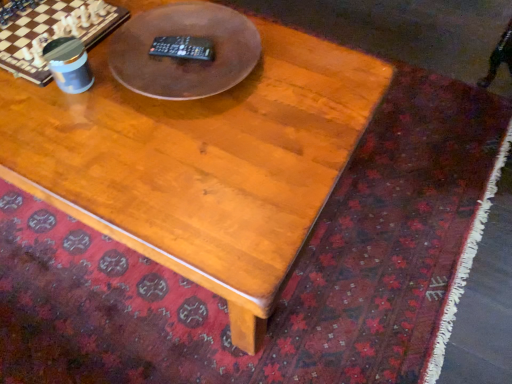
What is the approximate height of brown wooden table at center?

4.86 centimeters.

The width and height of the screenshot is (512, 384). What do you see at coordinates (184, 59) in the screenshot? I see `brown wooden table at center` at bounding box center [184, 59].

Locate an element on the screen. brown wooden table at center is located at coordinates (184, 59).

The image size is (512, 384). In order to click on wooden coffee table at center in this screenshot , I will do `click(201, 162)`.

What is the approximate width of wooden coffee table at center?

The width of wooden coffee table at center is 31.02 inches.

The image size is (512, 384). What do you see at coordinates (201, 162) in the screenshot?
I see `wooden coffee table at center` at bounding box center [201, 162].

Image resolution: width=512 pixels, height=384 pixels. I want to click on brown wooden table at center, so click(x=184, y=59).

Between wooden coffee table at center and brown wooden table at center, which one appears on the left side from the viewer's perspective?

wooden coffee table at center is more to the left.

Consider the image. Is wooden coffee table at center further to camera compared to brown wooden table at center?

No, it is not.

Does point (115, 88) lie in front of point (119, 37)?

Yes, point (115, 88) is closer to viewer.

From the image's perspective, is wooden coffee table at center on top of brown wooden table at center?

No, from the image's perspective, wooden coffee table at center is not on top of brown wooden table at center.

From a real-world perspective, is wooden coffee table at center physically located above or below brown wooden table at center?

In terms of real-world spatial position, wooden coffee table at center is below brown wooden table at center.

In terms of width, does wooden coffee table at center look wider or thinner when compared to brown wooden table at center?

Considering their sizes, wooden coffee table at center looks broader than brown wooden table at center.

Which of these two, wooden coffee table at center or brown wooden table at center, stands shorter?

brown wooden table at center is shorter.

Can you confirm if wooden coffee table at center is smaller than brown wooden table at center?

No.

Based on the photo, is brown wooden table at center located within wooden coffee table at center?

No, brown wooden table at center is not inside wooden coffee table at center.

Are wooden coffee table at center and brown wooden table at center making contact?

No, wooden coffee table at center is not in contact with brown wooden table at center.

Is wooden coffee table at center turned away from brown wooden table at center?

That's not correct — wooden coffee table at center is not looking away from brown wooden table at center.

Identify the location of coffee table in front of the brown wooden table at center. The height and width of the screenshot is (384, 512). (201, 162).

Considering the relative positions of brown wooden table at center and wooden coffee table at center in the image provided, is brown wooden table at center to the left of wooden coffee table at center from the viewer's perspective?

No.

Which object is further away from the camera taking this photo, brown wooden table at center or wooden coffee table at center?

brown wooden table at center.

Which is in front, point (147, 57) or point (91, 146)?

The point (91, 146) is in front.

From the image's perspective, is brown wooden table at center above or below wooden coffee table at center?

Clearly, from the image's perspective, brown wooden table at center is above wooden coffee table at center.

From a real-world perspective, who is located higher, brown wooden table at center or wooden coffee table at center?

brown wooden table at center.

Which object is thinner, brown wooden table at center or wooden coffee table at center?

brown wooden table at center is thinner.

From the picture: From their relative heights in the image, would you say brown wooden table at center is taller or shorter than wooden coffee table at center?

Result: brown wooden table at center is shorter than wooden coffee table at center.

In the scene shown: Between brown wooden table at center and wooden coffee table at center, which one has smaller size?

With smaller size is brown wooden table at center.

Is wooden coffee table at center surrounded by brown wooden table at center?

No, wooden coffee table at center is not a part of brown wooden table at center.

Is brown wooden table at center not near wooden coffee table at center?

No, brown wooden table at center is in close proximity to wooden coffee table at center.

Based on the photo, is brown wooden table at center positioned with its back to wooden coffee table at center?

brown wooden table at center is not turned away from wooden coffee table at center.

How many degrees apart are the facing directions of brown wooden table at center and wooden coffee table at center?

brown wooden table at center and wooden coffee table at center are facing 1.49 degrees away from each other.

How distant is brown wooden table at center from wooden coffee table at center?

They are 7.09 inches apart.

In the image, there is a brown wooden table at center. Where is `coffee table below it (from a real-world perspective)`? The height and width of the screenshot is (384, 512). coffee table below it (from a real-world perspective) is located at coordinates (201, 162).

Find the location of `coffee table directly beneath the brown wooden table at center (from a real-world perspective)`. coffee table directly beneath the brown wooden table at center (from a real-world perspective) is located at coordinates (201, 162).

The image size is (512, 384). What are the coordinates of `round table above the wooden coffee table at center (from the image's perspective)` in the screenshot? It's located at (184, 59).